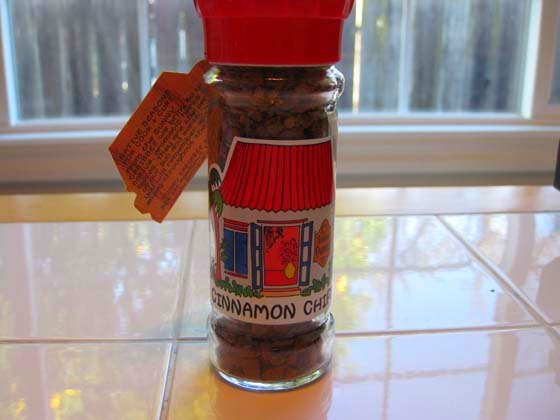
What are the coordinates of `tile countertop` in the screenshot? It's located at (432, 330).